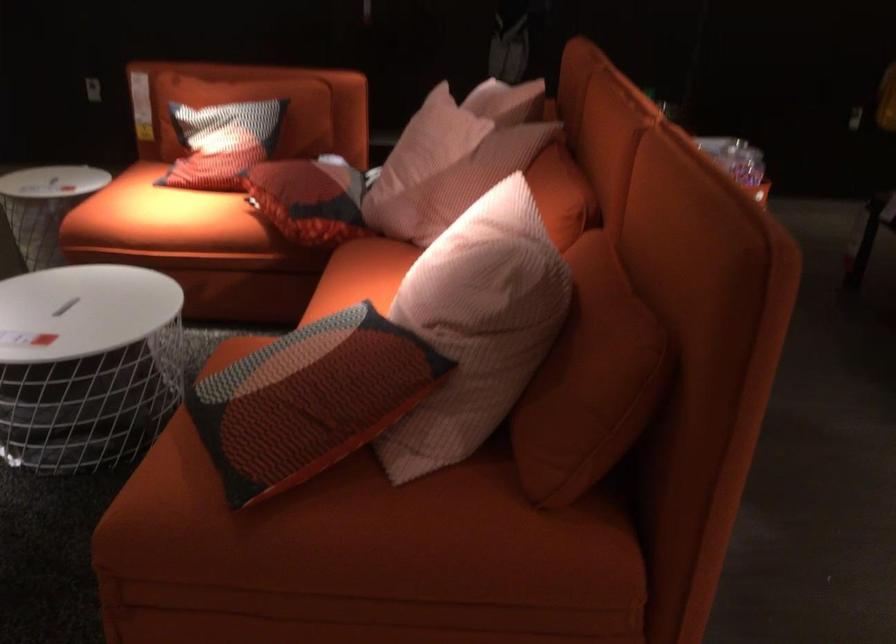
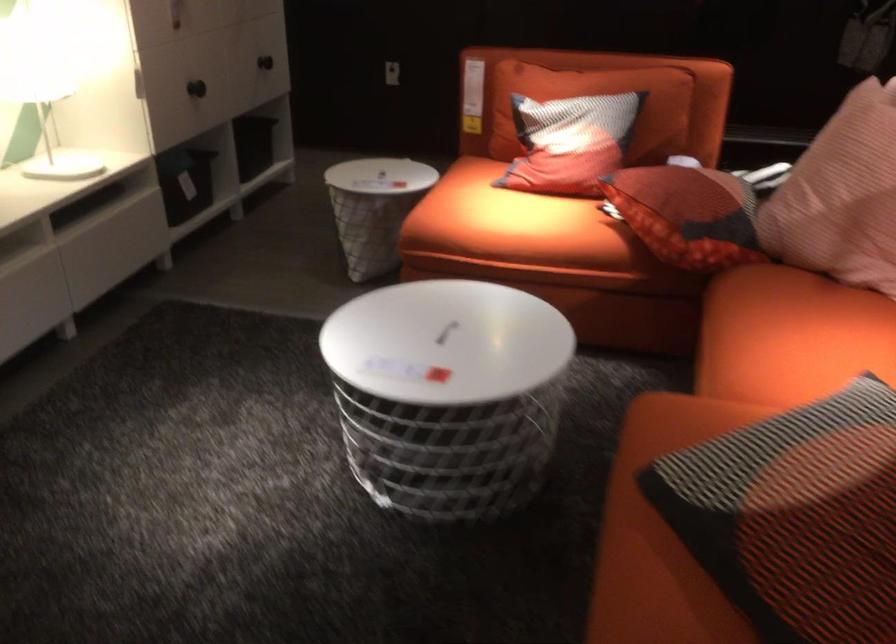
Question: The images are taken continuously from a first-person perspective. In which direction is your viewpoint rotating?

Choices:
 (A) Left
 (B) Right
 (C) Up
 (D) Down

Answer: (A)